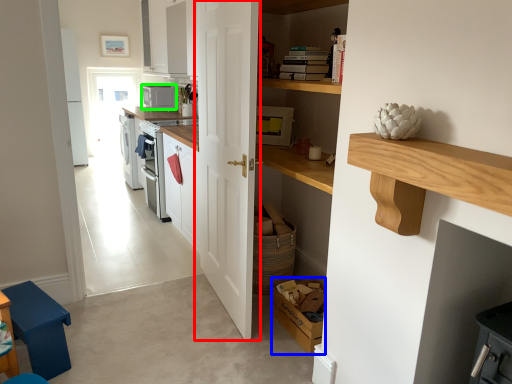
Question: Based on their relative distances, which object is farther from door (highlighted by a red box)? Choose from box (highlighted by a blue box) and appliance (highlighted by a green box).

Choices:
 (A) box
 (B) appliance

Answer: (B)